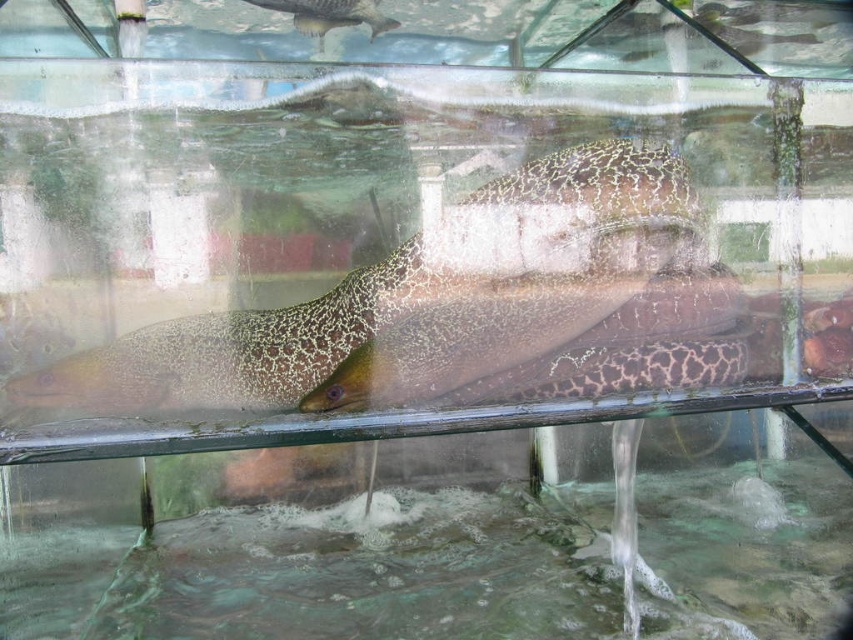
Question: Is speckled skin eel at center bigger than shiny silver fish at upper center?

Choices:
 (A) no
 (B) yes

Answer: (B)

Question: Which is nearer to the shiny silver fish at upper center?

Choices:
 (A) speckled skin eel at center
 (B) clear water at bottom

Answer: (A)

Question: In this image, where is clear water at bottom located relative to speckled skin eel at center?

Choices:
 (A) above
 (B) below

Answer: (B)

Question: Can you confirm if speckled skin eel at center is smaller than shiny silver fish at upper center?

Choices:
 (A) yes
 (B) no

Answer: (B)

Question: Which object appears farthest from the camera in this image?

Choices:
 (A) shiny silver fish at upper center
 (B) clear water at bottom
 (C) speckled skin eel at center

Answer: (A)

Question: Which object is the farthest from the speckled skin eel at center?

Choices:
 (A) shiny silver fish at upper center
 (B) clear water at bottom

Answer: (A)